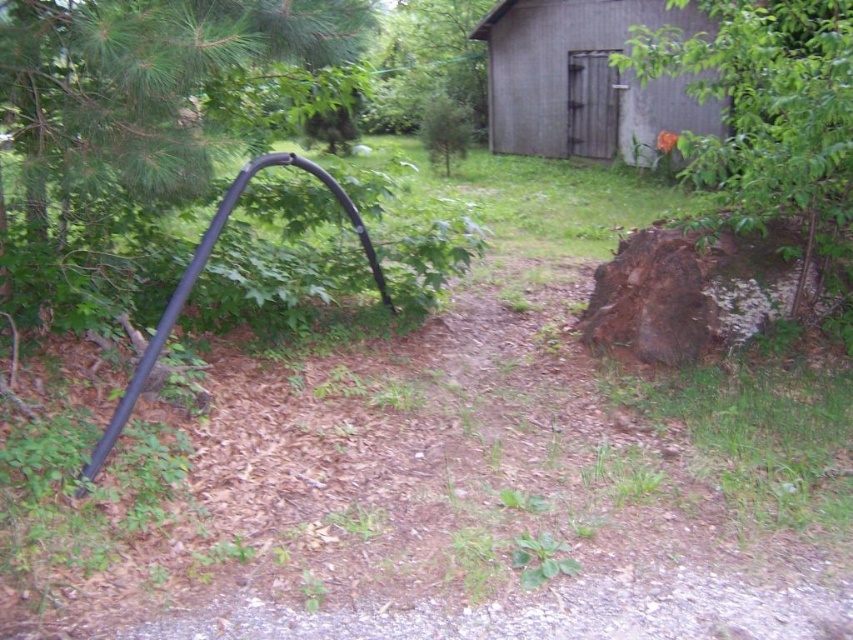
Is rough bark tree stump at right wider than green leafy tree at upper center?

No, rough bark tree stump at right is not wider than green leafy tree at upper center.

Is rough bark tree stump at right to the left of green leafy tree at upper center from the viewer's perspective?

Incorrect, rough bark tree stump at right is not on the left side of green leafy tree at upper center.

The height and width of the screenshot is (640, 853). What do you see at coordinates (769, 120) in the screenshot? I see `rough bark tree stump at right` at bounding box center [769, 120].

I want to click on rough bark tree stump at right, so click(769, 120).

Does point (550, 120) come behind point (401, 100)?

No, (550, 120) is in front of (401, 100).

Is point (634, 129) closer to camera compared to point (413, 100)?

Yes, it is.

Between point (523, 74) and point (408, 99), which one is positioned behind?

The point (408, 99) is behind.

Find the location of a particular element. This screenshot has width=853, height=640. gray wood hut at upper center is located at coordinates (583, 80).

Which of these two, black rubber hose at left or rough bark tree stump at right, stands taller?

rough bark tree stump at right

Looking at this image, is black rubber hose at left smaller than rough bark tree stump at right?

Correct, black rubber hose at left occupies less space than rough bark tree stump at right.

Is point (173, 35) in front of point (825, 160)?

Yes, it is.

The image size is (853, 640). Find the location of `black rubber hose at left`. black rubber hose at left is located at coordinates (144, 83).